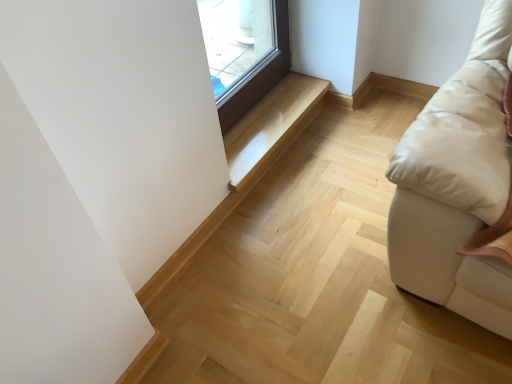
The width and height of the screenshot is (512, 384). Identify the location of free space above glossy wood bench at center, arranged as the 1th stairwell when viewed from the top (from a real-world perspective). coord(265,117).